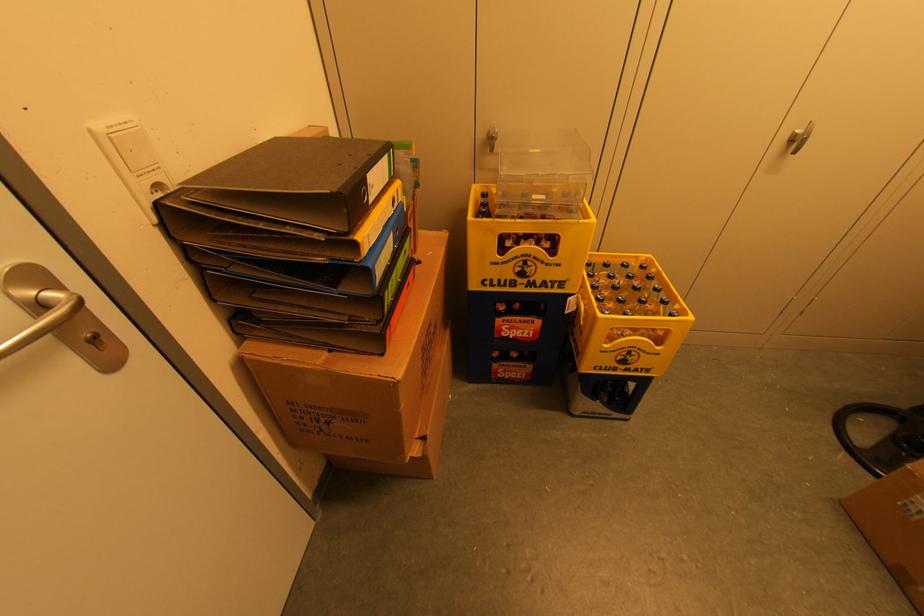
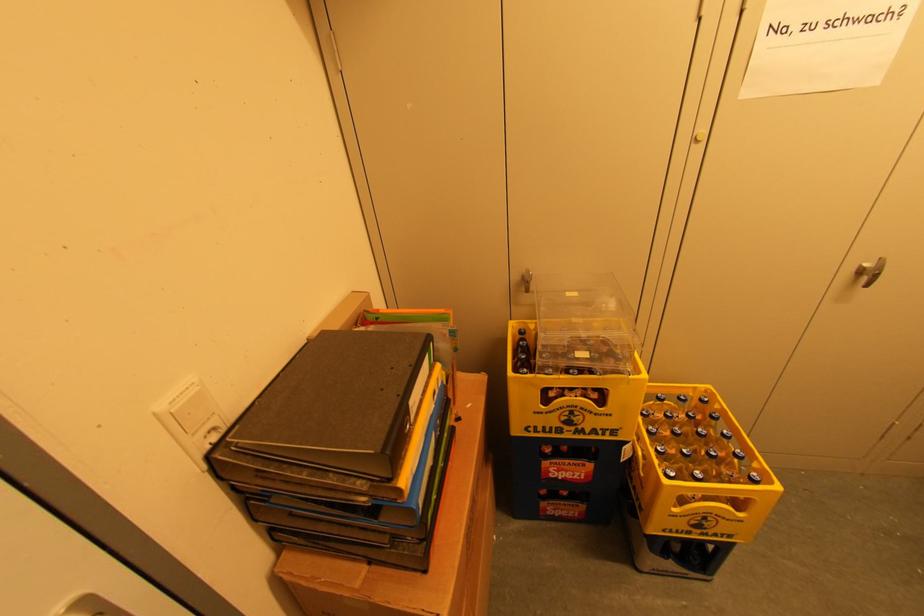
Find the pixel in the second image that matches point (659, 286) in the first image.

(726, 432)